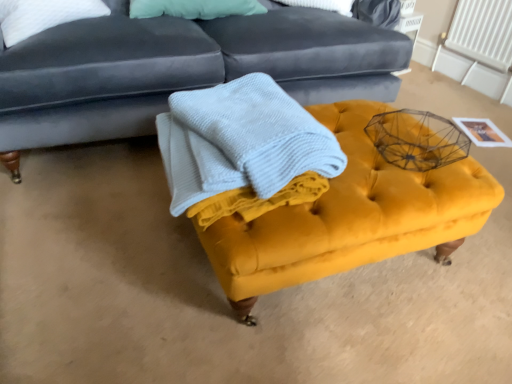
Question: Considering the relative sizes of light blue textured blanket at center and velvet yellow ottoman at center in the image provided, is light blue textured blanket at center smaller than velvet yellow ottoman at center?

Choices:
 (A) no
 (B) yes

Answer: (B)

Question: Can you confirm if light blue textured blanket at center is taller than velvet yellow ottoman at center?

Choices:
 (A) no
 (B) yes

Answer: (A)

Question: Is light blue textured blanket at center at the left side of velvet yellow ottoman at center?

Choices:
 (A) no
 (B) yes

Answer: (B)

Question: Is light blue textured blanket at center positioned far away from velvet yellow ottoman at center?

Choices:
 (A) yes
 (B) no

Answer: (B)

Question: From a real-world perspective, is light blue textured blanket at center under velvet yellow ottoman at center?

Choices:
 (A) no
 (B) yes

Answer: (A)

Question: Looking at their shapes, would you say light blue textured blanket at center is wider or thinner than velvet dark blue studio couch at upper center?

Choices:
 (A) wide
 (B) thin

Answer: (B)

Question: Is light blue textured blanket at center taller or shorter than velvet dark blue studio couch at upper center?

Choices:
 (A) short
 (B) tall

Answer: (A)

Question: Considering the positions of point (253, 165) and point (1, 105), is point (253, 165) closer or farther from the camera than point (1, 105)?

Choices:
 (A) closer
 (B) farther

Answer: (A)

Question: From the image's perspective, is light blue textured blanket at center above or below velvet dark blue studio couch at upper center?

Choices:
 (A) below
 (B) above

Answer: (A)

Question: Is light blue textured blanket at center in front of or behind velvet yellow ottoman at center in the image?

Choices:
 (A) front
 (B) behind

Answer: (A)

Question: Considering the positions of light blue textured blanket at center and velvet yellow ottoman at center in the image, is light blue textured blanket at center bigger or smaller than velvet yellow ottoman at center?

Choices:
 (A) big
 (B) small

Answer: (B)

Question: Is light blue textured blanket at center to the left or to the right of velvet yellow ottoman at center in the image?

Choices:
 (A) right
 (B) left

Answer: (B)

Question: In terms of height, does light blue textured blanket at center look taller or shorter compared to velvet yellow ottoman at center?

Choices:
 (A) tall
 (B) short

Answer: (B)

Question: Is light blue textured blanket at center wider or thinner than white plastic radiator at upper right?

Choices:
 (A) wide
 (B) thin

Answer: (A)

Question: From a real-world perspective, relative to white plastic radiator at upper right, is light blue textured blanket at center vertically above or below?

Choices:
 (A) above
 (B) below

Answer: (A)